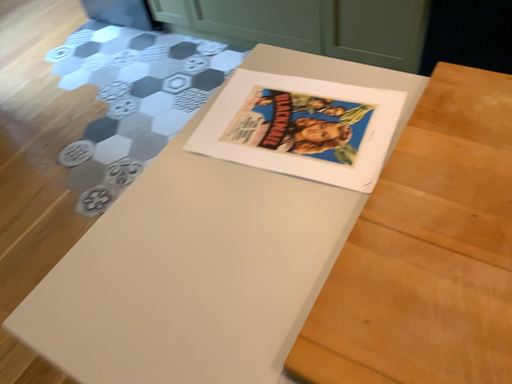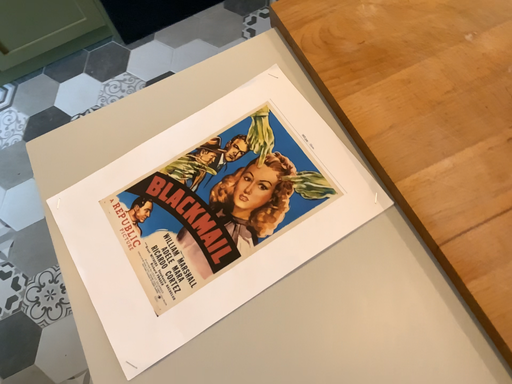
Question: Which way did the camera rotate in the video?

Choices:
 (A) rotated right
 (B) rotated left

Answer: (A)